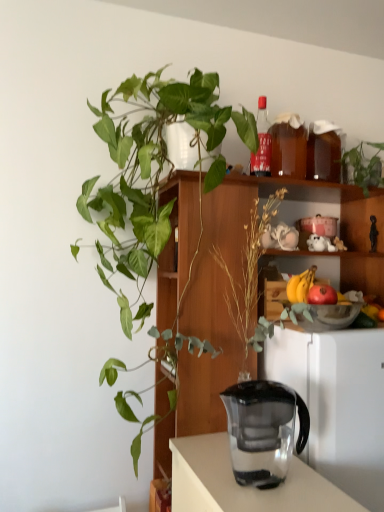
Question: Is point (345, 318) positioned closer to the camera than point (299, 279)?

Choices:
 (A) closer
 (B) farther

Answer: (A)

Question: Is translucent glass bowl at upper right taller or shorter than yellow matte bananas at center-right?

Choices:
 (A) tall
 (B) short

Answer: (B)

Question: Based on their relative distances, which object is nearer to the green leafy plant at left, which is counted as the second houseplant, starting from the right?

Choices:
 (A) transparent plastic jug at center
 (B) yellow matte bananas at center-right
 (C) translucent glass bottle at upper center
 (D) transparent plastic pitcher at lower center
 (E) wooden bookshelf at center

Answer: (E)

Question: Which of these objects is positioned closest to the green leafy plant at upper right, which ranks as the 1th houseplant in right-to-left order?

Choices:
 (A) translucent glass bottle at upper center
 (B) wooden bookshelf at center
 (C) green leafy plant at left, which is the 1th houseplant in left-to-right order
 (D) yellow matte bananas at center-right
 (E) red matte apple at upper right

Answer: (A)